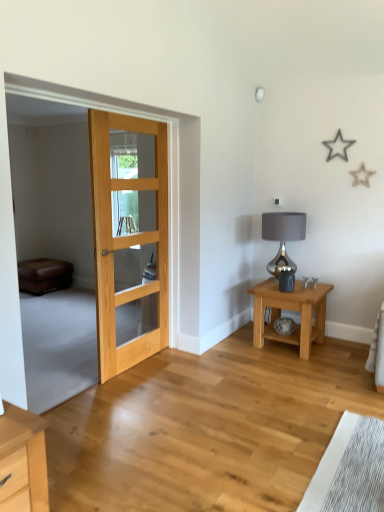
The image size is (384, 512). What are the coordinates of `vacant space to the left of light brown wood nightstand at lower right` in the screenshot? It's located at (236, 351).